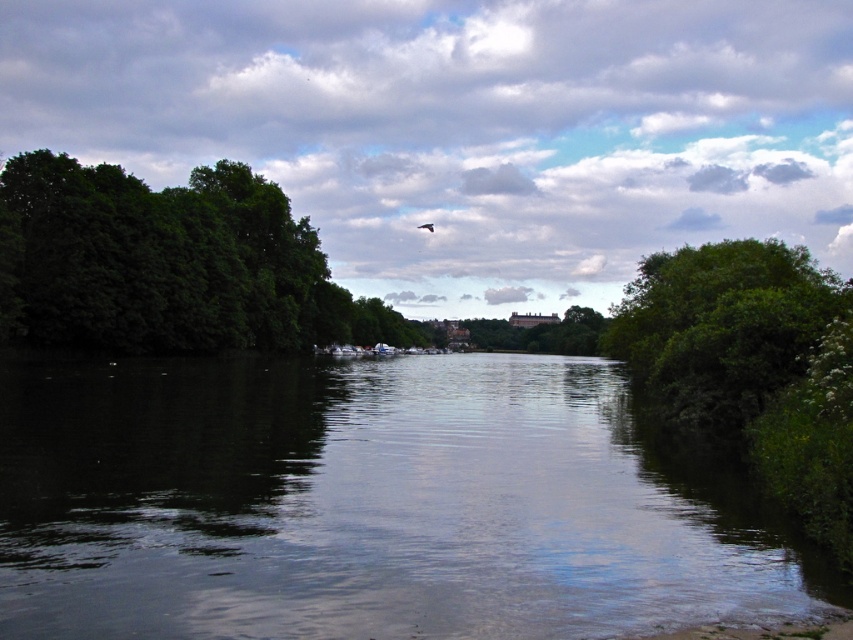
Can you confirm if dark reflective water at center is thinner than dark brown feathered bird at center?

In fact, dark reflective water at center might be wider than dark brown feathered bird at center.

Is dark reflective water at center positioned behind dark brown feathered bird at center?

That is False.

The image size is (853, 640). What do you see at coordinates (372, 502) in the screenshot?
I see `dark reflective water at center` at bounding box center [372, 502].

Locate an element on the screen. The width and height of the screenshot is (853, 640). dark reflective water at center is located at coordinates (372, 502).

Is green leafy trees at left shorter than green leafy tree at right?

Yes.

Can you confirm if green leafy trees at left is positioned to the left of green leafy tree at right?

Indeed, green leafy trees at left is positioned on the left side of green leafy tree at right.

Is point (229, 324) positioned in front of point (718, 372)?

No, (229, 324) is behind (718, 372).

This screenshot has width=853, height=640. Identify the location of green leafy trees at left. (171, 264).

Does green leafy tree at right have a greater height compared to dark brown feathered bird at center?

Indeed, green leafy tree at right has a greater height compared to dark brown feathered bird at center.

Between green leafy tree at right and dark brown feathered bird at center, which one has less height?

Standing shorter between the two is dark brown feathered bird at center.

Who is more distant from viewer, (x=646, y=285) or (x=432, y=225)?

Point (x=432, y=225)

Locate an element on the screen. This screenshot has height=640, width=853. green leafy tree at right is located at coordinates (723, 324).